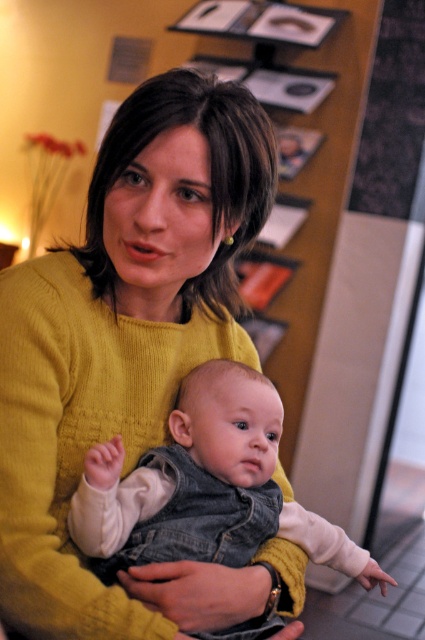
Does yellow knitted sweater at center have a larger size compared to denim vest at center?

Yes, yellow knitted sweater at center is bigger than denim vest at center.

The image size is (425, 640). Describe the element at coordinates (132, 356) in the screenshot. I see `yellow knitted sweater at center` at that location.

Locate an element on the screen. yellow knitted sweater at center is located at coordinates (132, 356).